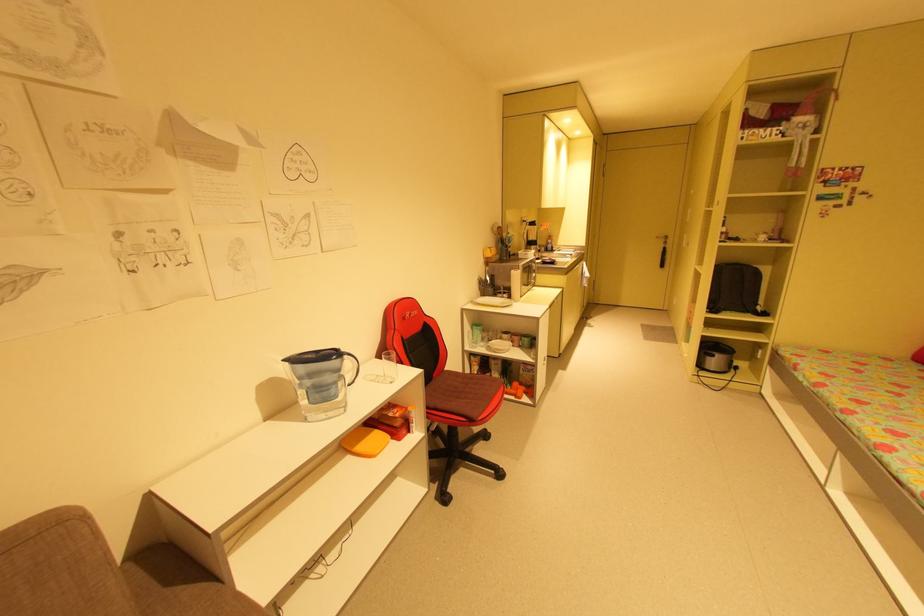
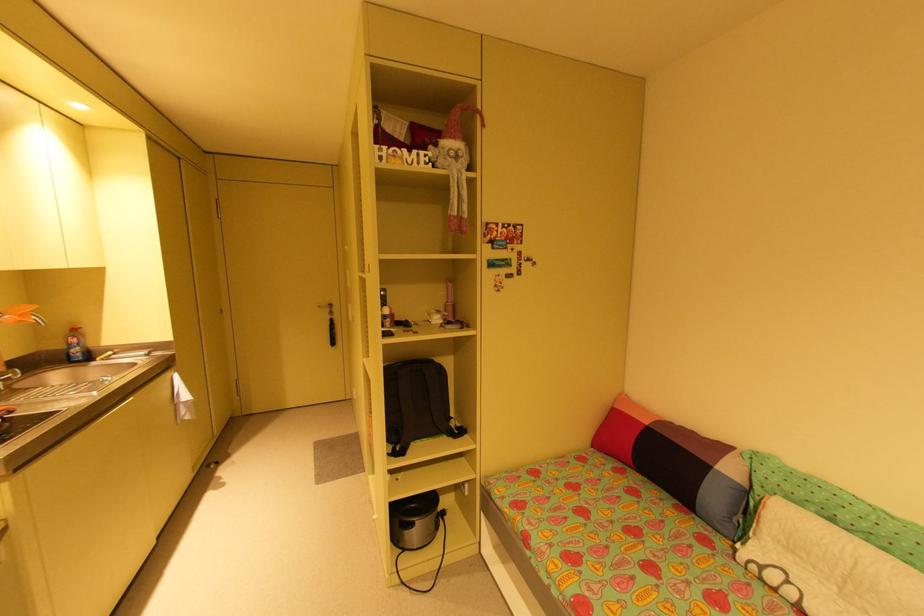
Where in the second image is the point corresponding to [718,355] from the first image?

(417, 525)